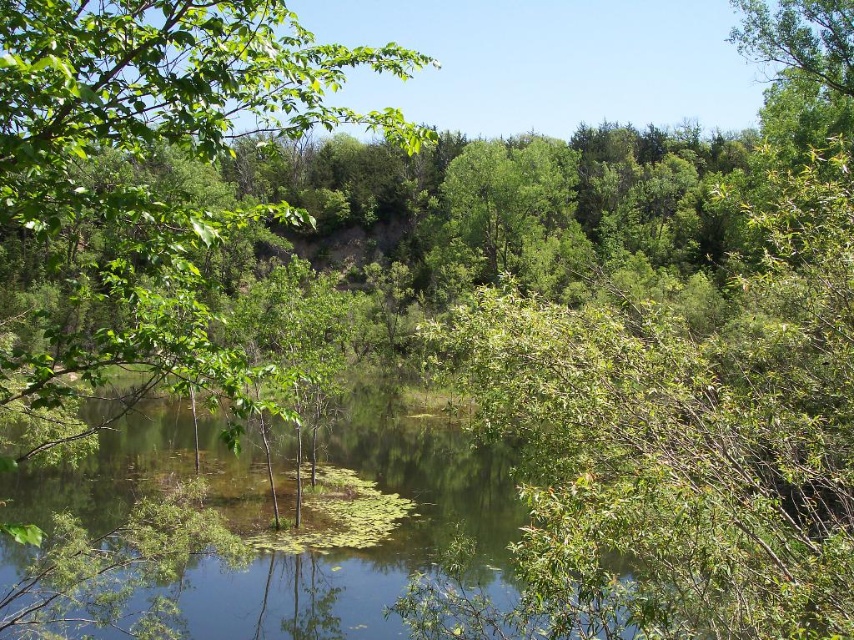
You are standing at the edge of the pond and want to reach the green leafy tree at center. Which direction should you move relative to the green leafy water at center to get there?

To reach the green leafy tree at center from the edge of the pond, you should move to the left of the green leafy water at center since the green leafy water at center is positioned to the right of the green leafy tree at center.

Consider the image. You are standing at the edge of the pond and want to place a small decorative rock at the point marked by point (261, 536). Based on the scene description, can you confirm if this location is over the green leafy water at center?

Yes, the point (261, 536) corresponds to the green leafy water at center, so placing the rock there would be over the water.